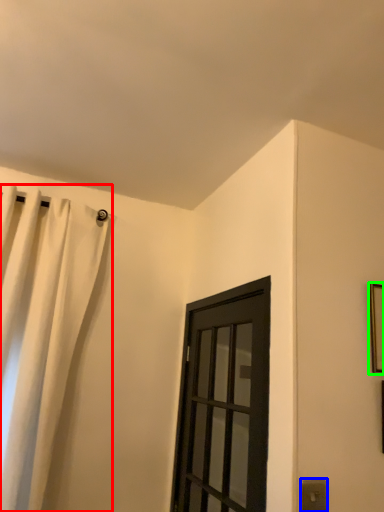
Question: Based on their relative distances, which object is farther from curtain (highlighted by a red box)? Choose from electric outlet (highlighted by a blue box) and picture frame (highlighted by a green box).

Choices:
 (A) electric outlet
 (B) picture frame

Answer: (B)